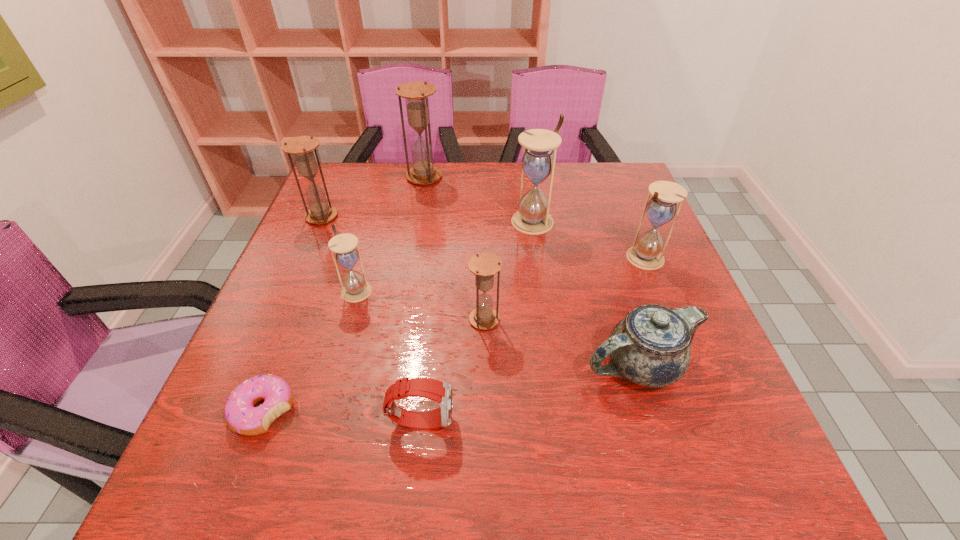
Identify the location of chinaware positioned at the right edge. The image size is (960, 540). (651, 346).

Where is `object that is positioned at the far left corner`? The width and height of the screenshot is (960, 540). object that is positioned at the far left corner is located at coordinates (301, 147).

The width and height of the screenshot is (960, 540). Find the location of `free space at the far edge of the desktop`. free space at the far edge of the desktop is located at coordinates (498, 201).

Identify the location of vacant region at the left edge of the desktop. (311, 399).

Locate an element on the screen. Image resolution: width=960 pixels, height=540 pixels. vacant space at the right edge is located at coordinates (628, 272).

In the image, there is a desktop. Where is `vacant space at the far left corner`? Image resolution: width=960 pixels, height=540 pixels. vacant space at the far left corner is located at coordinates (335, 176).

This screenshot has height=540, width=960. In order to click on free region at the far right corner of the desktop in this screenshot , I will do `click(597, 176)`.

The width and height of the screenshot is (960, 540). Identify the location of free location at the near right corner. (729, 487).

Locate an element on the screen. free space that is in between the watch and the chinaware is located at coordinates (530, 392).

Find the location of a particular element. The image size is (960, 540). free space between the fifth hourglass from right to left and the eighth tallest object is located at coordinates [x=389, y=355].